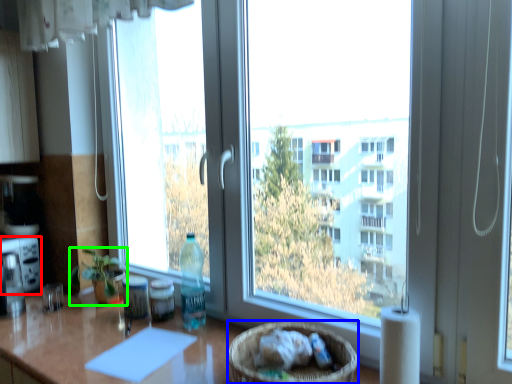
Question: Which is nearer to the appliance (highlighted by a red box)? basket (highlighted by a blue box) or houseplant (highlighted by a green box).

Choices:
 (A) basket
 (B) houseplant

Answer: (B)